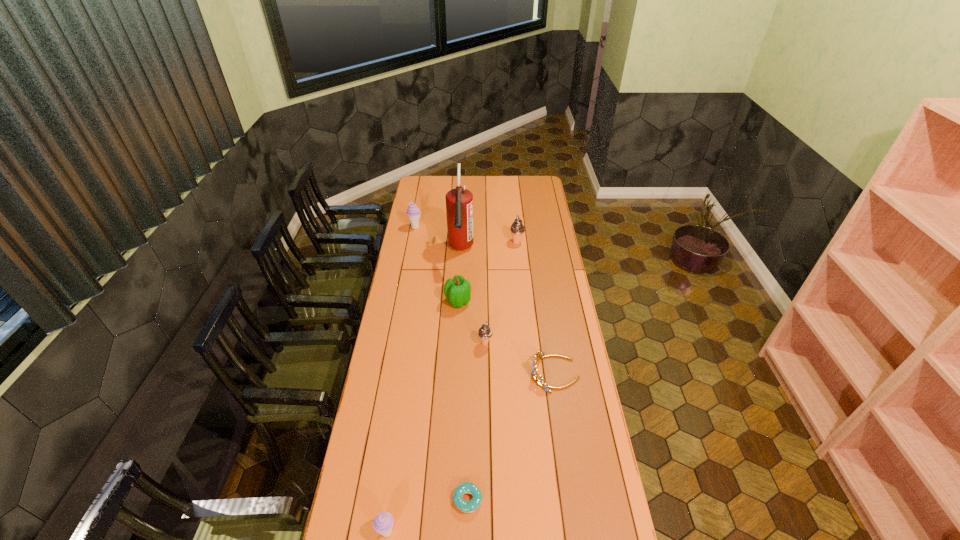
Where is `fire extinguisher`? The width and height of the screenshot is (960, 540). fire extinguisher is located at coordinates (459, 202).

Find the location of a particular element. The image size is (960, 540). the tallest object is located at coordinates (459, 202).

Locate an element on the screen. the bigger chocolate icecream is located at coordinates (517, 228).

This screenshot has width=960, height=540. Find the location of `the second farthest icecream`. the second farthest icecream is located at coordinates (517, 228).

The height and width of the screenshot is (540, 960). Identify the location of the leftmost icecream. point(413,212).

You are a GUI agent. You are given a task and a screenshot of the screen. Output one action in this format:
    pyautogui.click(x=<x>, y=<y>)
    Task: Click on the left purple icecream
    The width and height of the screenshot is (960, 540).
    Given the screenshot: What is the action you would take?
    pyautogui.click(x=413, y=212)

I want to click on the fourth farthest object, so click(457, 291).

Where is `bell pepper`? This screenshot has height=540, width=960. bell pepper is located at coordinates (457, 291).

Image resolution: width=960 pixels, height=540 pixels. In order to click on the third farthest icecream in this screenshot , I will do `click(485, 332)`.

Where is `the third icecream from left to right`? The image size is (960, 540). the third icecream from left to right is located at coordinates (485, 332).